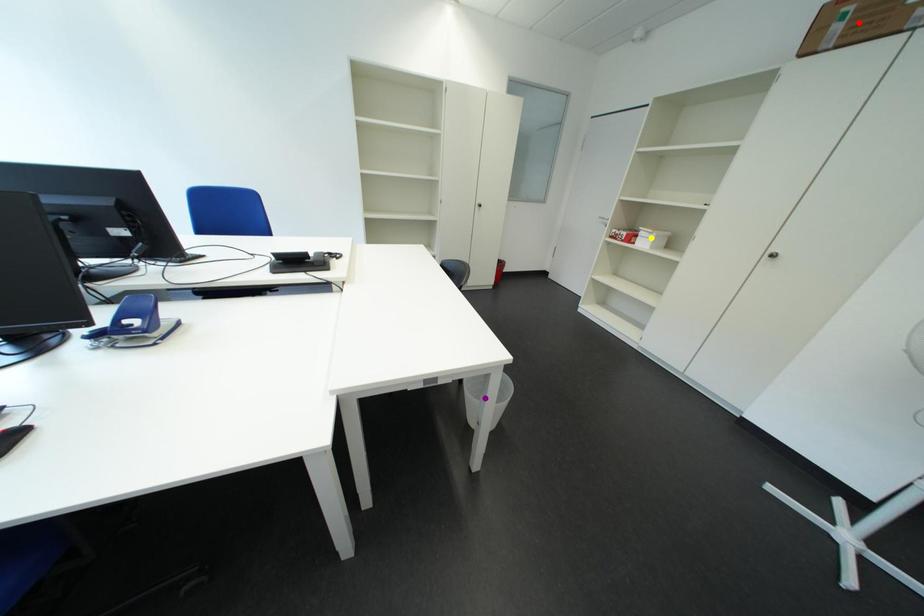
Order these from nearest to farthest:
- red point
- yellow point
- purple point

yellow point, purple point, red point